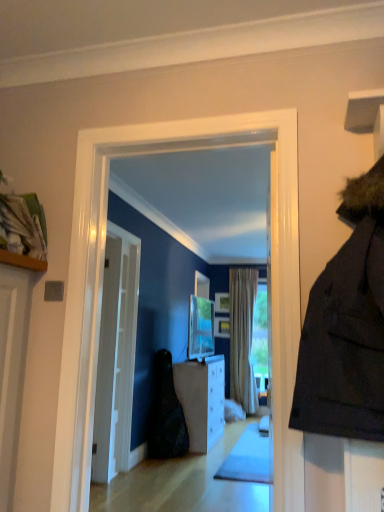
Question: Does wooden picture frame at center, the 1th picture frame in the top-to-bottom sequence, appear on the left side of white glossy door at center?

Choices:
 (A) no
 (B) yes

Answer: (A)

Question: Can you confirm if wooden picture frame at center, the 1th picture frame in the top-to-bottom sequence, is thinner than white glossy door at center?

Choices:
 (A) yes
 (B) no

Answer: (A)

Question: From a real-world perspective, is wooden picture frame at center, the second picture frame in the bottom-to-top sequence, physically below white glossy door at center?

Choices:
 (A) yes
 (B) no

Answer: (B)

Question: From the image's perspective, would you say wooden picture frame at center, the second picture frame in the bottom-to-top sequence, is shown under white glossy door at center?

Choices:
 (A) yes
 (B) no

Answer: (B)

Question: From the image's perspective, would you say wooden picture frame at center, the 1th picture frame in the top-to-bottom sequence, is positioned over white glossy door at center?

Choices:
 (A) no
 (B) yes

Answer: (B)

Question: Is matte silver tv at center taller or shorter than wooden picture frame at center, placed as the second picture frame when sorted from top to bottom?

Choices:
 (A) tall
 (B) short

Answer: (A)

Question: Would you say matte silver tv at center is inside or outside wooden picture frame at center, placed as the second picture frame when sorted from top to bottom?

Choices:
 (A) inside
 (B) outside

Answer: (B)

Question: Looking at the image, does matte silver tv at center seem bigger or smaller compared to wooden picture frame at center, placed as the first picture frame when sorted from bottom to top?

Choices:
 (A) big
 (B) small

Answer: (A)

Question: Is point (210, 313) positioned closer to the camera than point (215, 323)?

Choices:
 (A) farther
 (B) closer

Answer: (B)

Question: Visually, is matte silver tv at center positioned to the left or to the right of white glossy door at center?

Choices:
 (A) left
 (B) right

Answer: (B)

Question: Considering the positions of matte silver tv at center and white glossy door at center in the image, is matte silver tv at center wider or thinner than white glossy door at center?

Choices:
 (A) thin
 (B) wide

Answer: (A)

Question: From the image's perspective, is matte silver tv at center positioned above or below white glossy door at center?

Choices:
 (A) above
 (B) below

Answer: (B)

Question: Considering the positions of matte silver tv at center and white glossy door at center in the image, is matte silver tv at center taller or shorter than white glossy door at center?

Choices:
 (A) short
 (B) tall

Answer: (A)

Question: From the image's perspective, relative to matte silver tv at center, is black fabric bag at center above or below?

Choices:
 (A) above
 (B) below

Answer: (B)

Question: In terms of width, does black fabric bag at center look wider or thinner when compared to matte silver tv at center?

Choices:
 (A) wide
 (B) thin

Answer: (A)